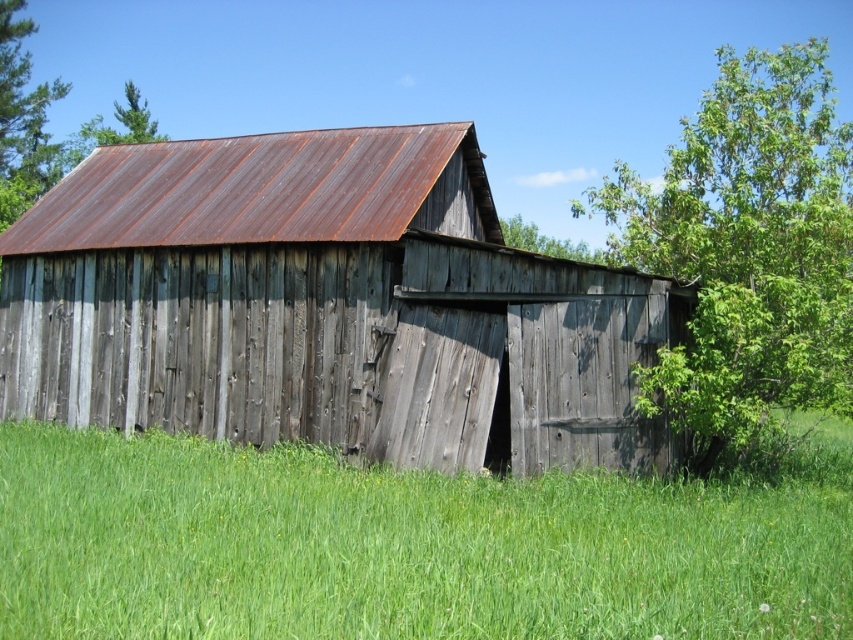
Question: Is green leafy tree at right positioned before green leafy tree at upper right?

Choices:
 (A) no
 (B) yes

Answer: (B)

Question: Which object appears closest to the camera in this image?

Choices:
 (A) rusty metal shed at center
 (B) green leafy tree at upper right
 (C) green leafy tree at upper left

Answer: (A)

Question: Is green grass at lower center smaller than green leafy tree at upper left?

Choices:
 (A) yes
 (B) no

Answer: (A)

Question: Among these objects, which one is farthest from the camera?

Choices:
 (A) green grass at lower center
 (B) green leafy tree at upper right
 (C) rusty metal shed at center

Answer: (B)

Question: Which object appears closest to the camera in this image?

Choices:
 (A) green leafy tree at upper right
 (B) green grass at lower center
 (C) rusty metal shed at center
 (D) green leafy tree at upper left

Answer: (B)

Question: Is rusty metal shed at center positioned at the back of green leafy tree at upper right?

Choices:
 (A) yes
 (B) no

Answer: (B)